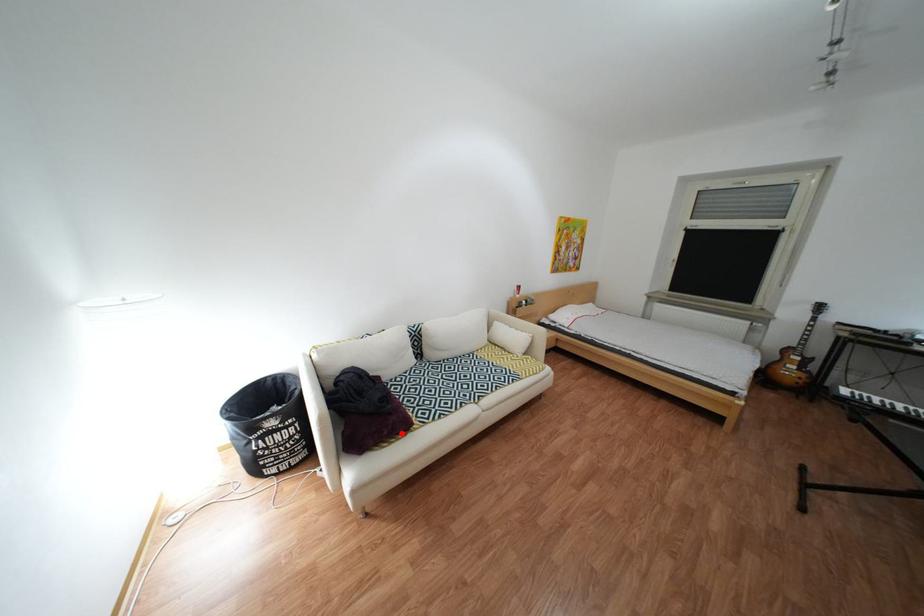
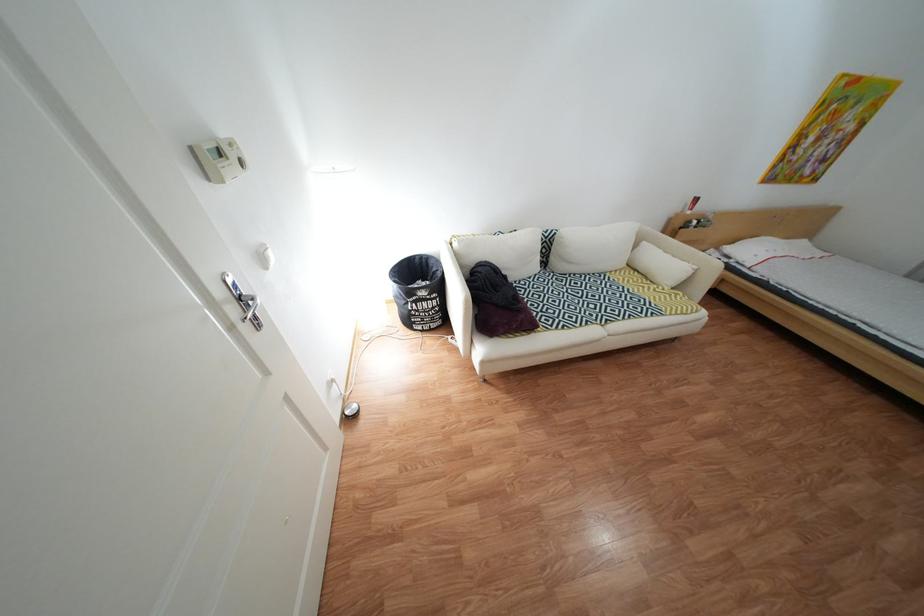
In the second image, find the point that corresponds to the highlighted location in the first image.

(530, 328)